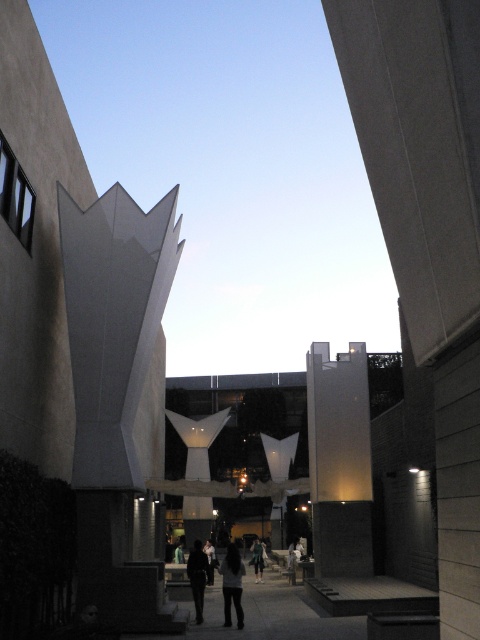
You are standing at the starting point of the walkway and notice two points marked in the scene. The first point is at coordinates point (160, 266) and the second is at point (189, 577). Which point is closer to you as you stand at the beginning of the walkway?

Point (160, 266) is in front of point (189, 577), so it is closer to you as you stand at the beginning of the walkway.

You are an architect analyzing the central structure in the image. You notice two elements at the center, dark gray pants at center and dark clothing at center. Which of these two elements is narrower in width?

The dark gray pants at center has a lesser width compared to dark clothing at center, so it is narrower.